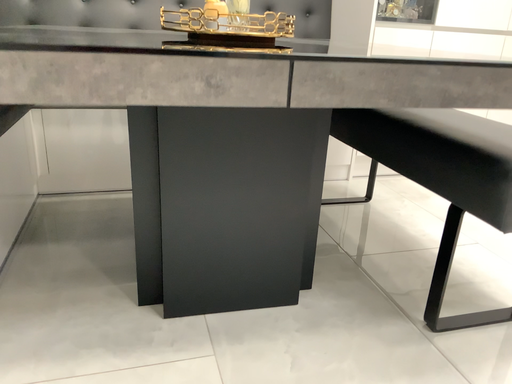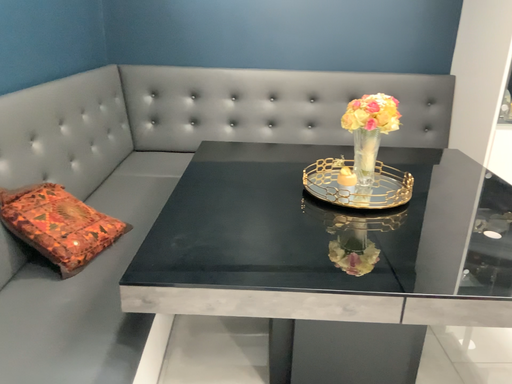
Question: How did the camera likely rotate when shooting the video?

Choices:
 (A) rotated right
 (B) rotated left

Answer: (B)